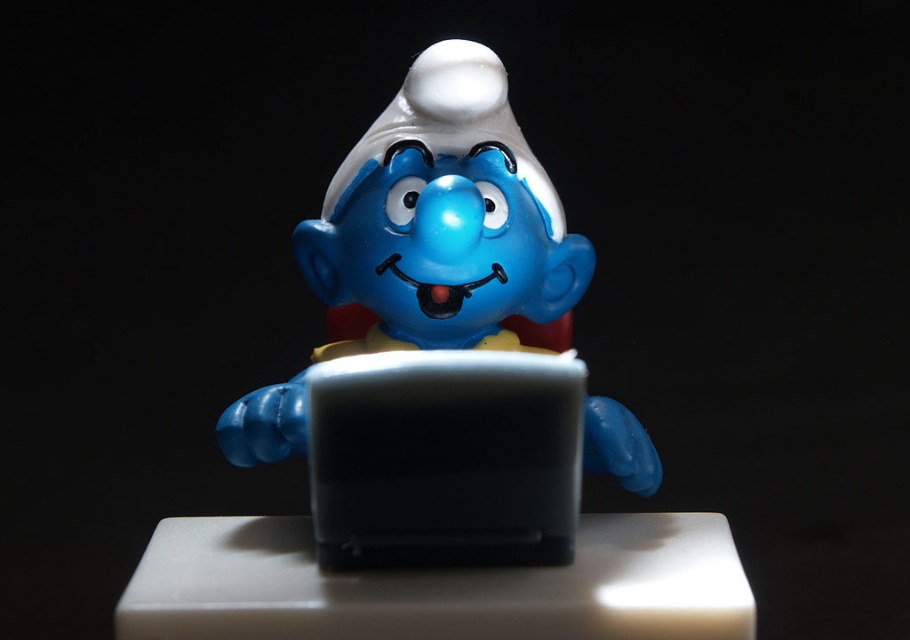
Question: Does matte plastic smurf at center lie behind black plastic laptop at center?

Choices:
 (A) yes
 (B) no

Answer: (A)

Question: Considering the relative positions of matte plastic smurf at center and black plastic laptop at center in the image provided, where is matte plastic smurf at center located with respect to black plastic laptop at center?

Choices:
 (A) left
 (B) right

Answer: (B)

Question: Among these objects, which one is nearest to the camera?

Choices:
 (A) black plastic laptop at center
 (B) matte plastic smurf at center

Answer: (A)

Question: Can you confirm if matte plastic smurf at center is positioned to the right of black plastic laptop at center?

Choices:
 (A) yes
 (B) no

Answer: (A)